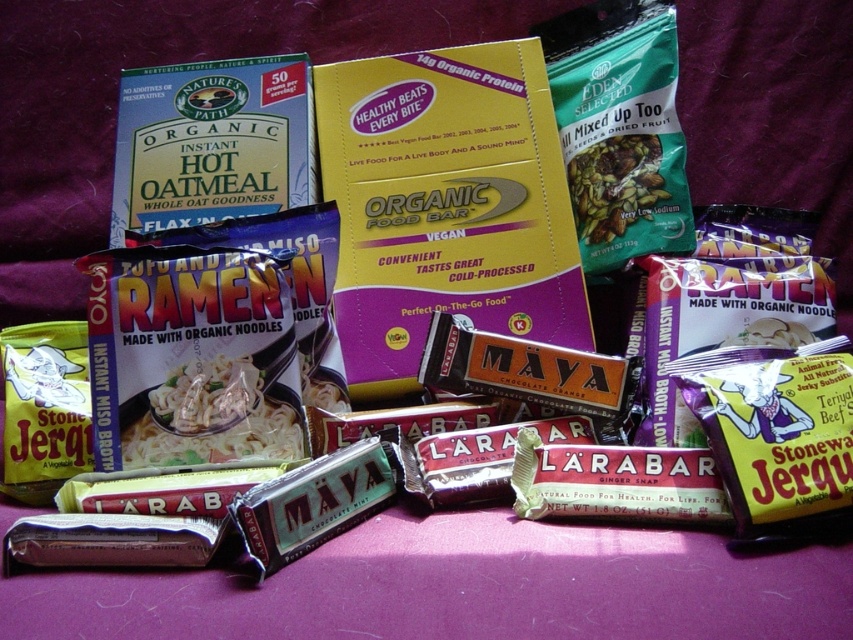
Question: Is chocolate bar at center bigger than green matte snack mix at center?

Choices:
 (A) no
 (B) yes

Answer: (B)

Question: From the image, what is the correct spatial relationship of chocolate bar at center in relation to green matte snack mix at center?

Choices:
 (A) right
 (B) left

Answer: (B)

Question: Does chocolate bar at center have a larger size compared to green matte snack mix at center?

Choices:
 (A) yes
 (B) no

Answer: (A)